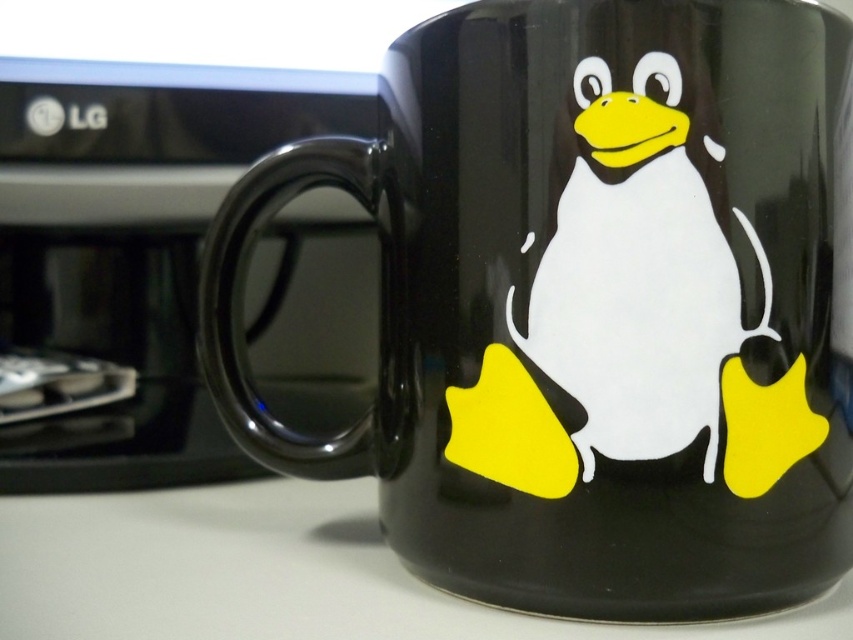
You are organizing your desk and want to place a new keyboard between the black glossy monitor at upper left and the white glossy penguin at center. Based on their positions, where should the keyboard be placed?

The keyboard should be placed below the black glossy monitor at upper left and above the white glossy penguin at center since the monitor is located above the penguin.

You are trying to place a new sticker on the black ceramic mug. The sticker is 1 cm in diameter. The sticker can only be placed at the exact center of the mug. The center of the mug is at point (132, 246). Is the sticker within the mug? Please answer yes or no.

The sticker is placed at the exact center of the mug, which is at point (132, 246). Since the sticker is placed exactly at the center, it will be within the mug.